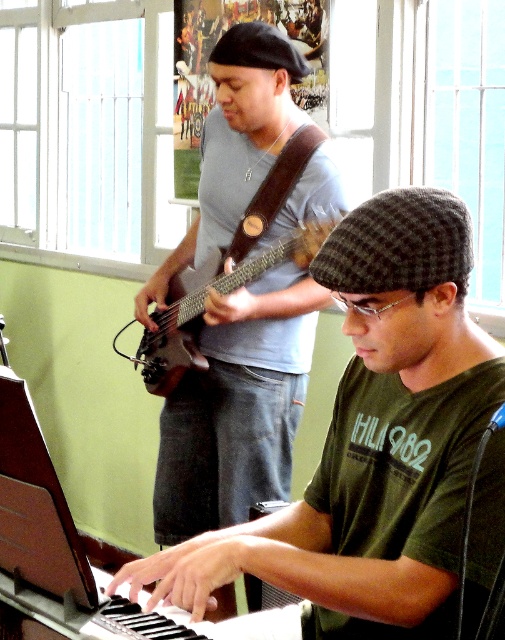
Question: Which of the following is the farthest from the observer?

Choices:
 (A) (482, 352)
 (B) (178, 284)

Answer: (B)

Question: Does green matte shirt at center have a greater width compared to matte gray shirt at center?

Choices:
 (A) yes
 (B) no

Answer: (A)

Question: Which of the following is the closest to the observer?

Choices:
 (A) (320, 577)
 (B) (174, 378)
 (C) (155, 509)

Answer: (A)

Question: Is the position of green matte shirt at center less distant than that of matte gray shirt at center?

Choices:
 (A) no
 (B) yes

Answer: (B)

Question: Which of the following is the closest to the observer?

Choices:
 (A) (261, 342)
 (B) (153, 337)

Answer: (A)

Question: Where is green matte shirt at center located in relation to matte gray shirt at center in the image?

Choices:
 (A) below
 (B) above

Answer: (A)